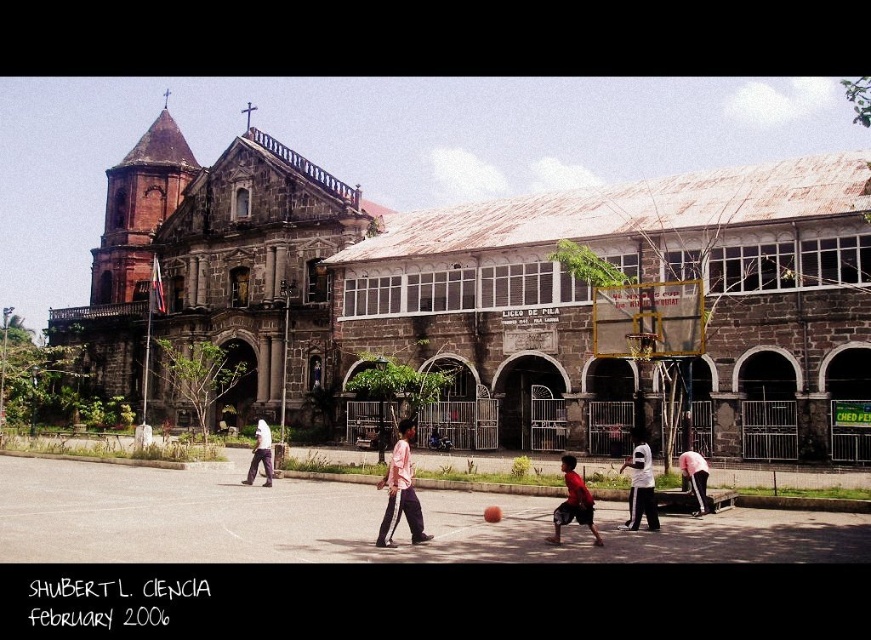
The image size is (871, 640). What do you see at coordinates (640, 483) in the screenshot?
I see `white cotton shirt at center` at bounding box center [640, 483].

The image size is (871, 640). In order to click on white cotton shirt at center in this screenshot , I will do `click(640, 483)`.

Based on the photo, does red matte shirt at lower center appear on the right side of light brown pants at center?

Yes, red matte shirt at lower center is to the right of light brown pants at center.

The image size is (871, 640). What do you see at coordinates (572, 502) in the screenshot?
I see `red matte shirt at lower center` at bounding box center [572, 502].

Locate an element on the screen. This screenshot has width=871, height=640. red matte shirt at lower center is located at coordinates (572, 502).

Does dark brown stone church at upper left appear under pink fabric shirt at lower right?

Actually, dark brown stone church at upper left is above pink fabric shirt at lower right.

Is dark brown stone church at upper left wider than pink fabric shirt at lower right?

Indeed, dark brown stone church at upper left has a greater width compared to pink fabric shirt at lower right.

Which is behind, point (213, 172) or point (707, 506)?

Positioned behind is point (213, 172).

The image size is (871, 640). What are the coordinates of `dark brown stone church at upper left` in the screenshot? It's located at (215, 268).